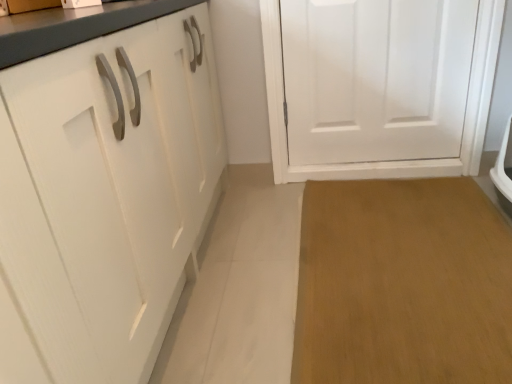
Question: Considering the relative sizes of white matte door at center and brown wood floor at lower right in the image provided, is white matte door at center thinner than brown wood floor at lower right?

Choices:
 (A) yes
 (B) no

Answer: (A)

Question: Is white matte door at center looking in the opposite direction of brown wood floor at lower right?

Choices:
 (A) no
 (B) yes

Answer: (A)

Question: Is white matte door at center not inside brown wood floor at lower right?

Choices:
 (A) yes
 (B) no

Answer: (A)

Question: Does white matte door at center have a greater height compared to brown wood floor at lower right?

Choices:
 (A) yes
 (B) no

Answer: (A)

Question: Are white matte door at center and brown wood floor at lower right far apart?

Choices:
 (A) no
 (B) yes

Answer: (A)

Question: From a real-world perspective, does white matte door at center stand above brown wood floor at lower right?

Choices:
 (A) no
 (B) yes

Answer: (B)

Question: Is brown wood floor at lower right not inside white matte door at center?

Choices:
 (A) no
 (B) yes

Answer: (B)

Question: Is brown wood floor at lower right far away from white matte door at center?

Choices:
 (A) no
 (B) yes

Answer: (A)

Question: Can you confirm if brown wood floor at lower right is wider than white matte door at center?

Choices:
 (A) yes
 (B) no

Answer: (A)

Question: From a real-world perspective, is brown wood floor at lower right below white matte door at center?

Choices:
 (A) no
 (B) yes

Answer: (B)

Question: Is brown wood floor at lower right behind white matte door at center?

Choices:
 (A) yes
 (B) no

Answer: (B)

Question: From a real-world perspective, does brown wood floor at lower right stand above white matte door at center?

Choices:
 (A) yes
 (B) no

Answer: (B)

Question: Looking at their shapes, would you say white matte door at center is wider or thinner than brown wood floor at lower right?

Choices:
 (A) thin
 (B) wide

Answer: (A)